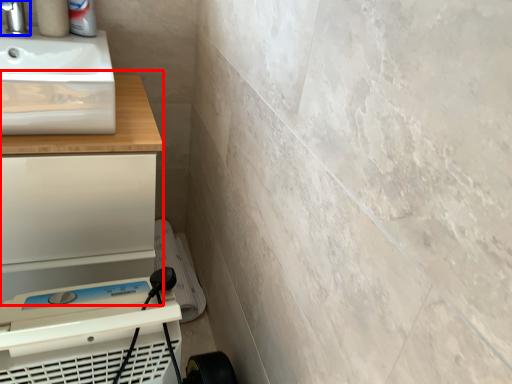
Question: Which point is further to the camera, counter (highlighted by a red box) or tap (highlighted by a blue box)?

Choices:
 (A) counter
 (B) tap

Answer: (B)